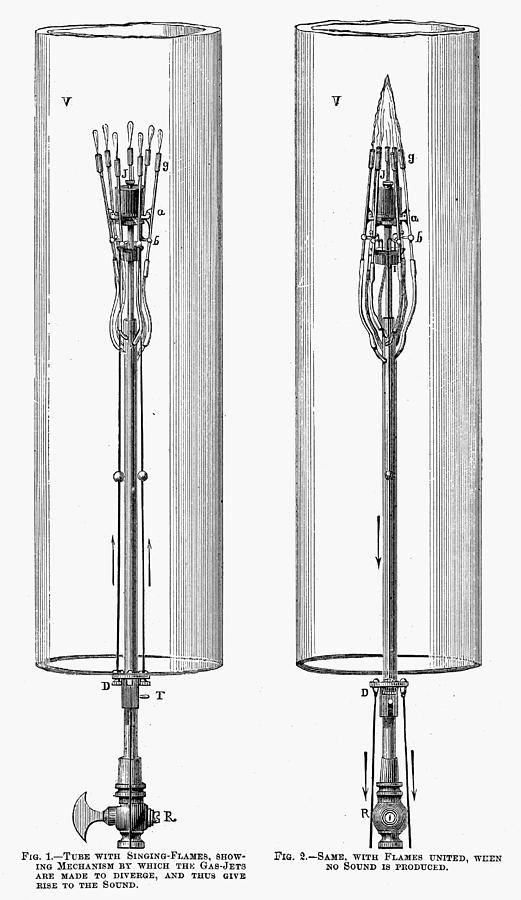
Where is `knob`? The image size is (521, 900). knob is located at coordinates (79, 810).